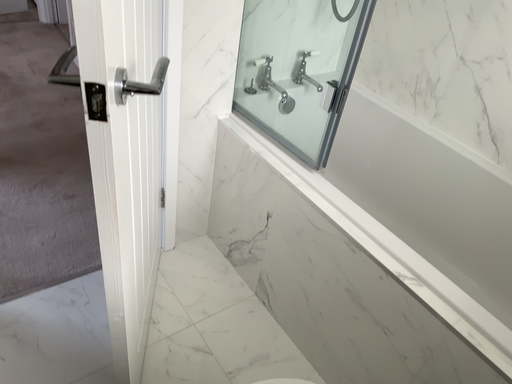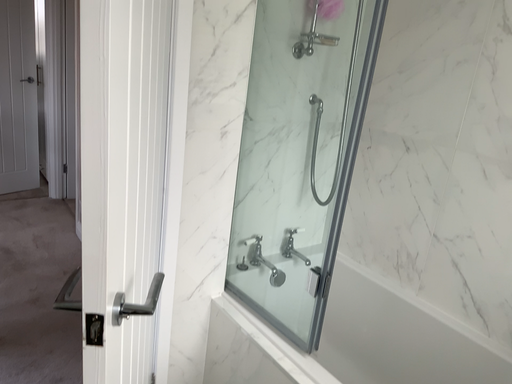
Question: How did the camera likely rotate when shooting the video?

Choices:
 (A) rotated upward
 (B) rotated downward

Answer: (A)